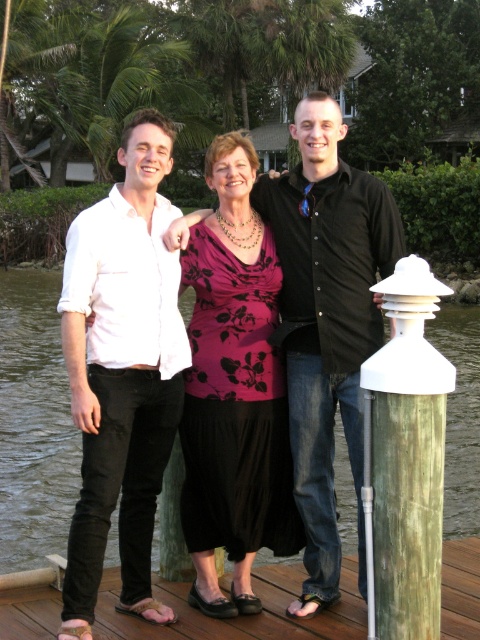
Question: Which object is the farthest from the matte black shirt at center?

Choices:
 (A) transparent water at dock center
 (B) wooden at lower center
 (C) white painted wood post at lower right

Answer: (A)

Question: Which is farther from the matte black shirt at center?

Choices:
 (A) white painted wood post at lower right
 (B) floral print blouse at center
 (C) transparent water at dock center

Answer: (C)

Question: Can you confirm if white cotton shirt at left is bigger than white painted wood post at lower right?

Choices:
 (A) no
 (B) yes

Answer: (A)

Question: Can you confirm if floral print blouse at center is positioned to the left of matte black shirt at center?

Choices:
 (A) no
 (B) yes

Answer: (B)

Question: Which object appears farthest from the camera in this image?

Choices:
 (A) transparent water at dock center
 (B) matte black shirt at center
 (C) white cotton shirt at left

Answer: (C)

Question: Is floral print blouse at center smaller than white painted wood post at lower right?

Choices:
 (A) yes
 (B) no

Answer: (B)